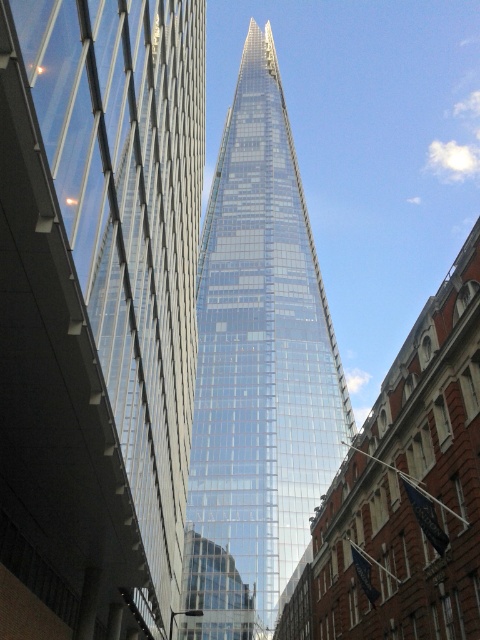
Is transparent glass skyscraper at center thinner than transparent glass tower at center?

Yes, transparent glass skyscraper at center is thinner than transparent glass tower at center.

Where is `transparent glass skyscraper at center`? transparent glass skyscraper at center is located at coordinates (97, 310).

Is point (145, 596) less distant than point (235, 189)?

Yes, it is in front of point (235, 189).

This screenshot has width=480, height=640. I want to click on transparent glass skyscraper at center, so click(x=97, y=310).